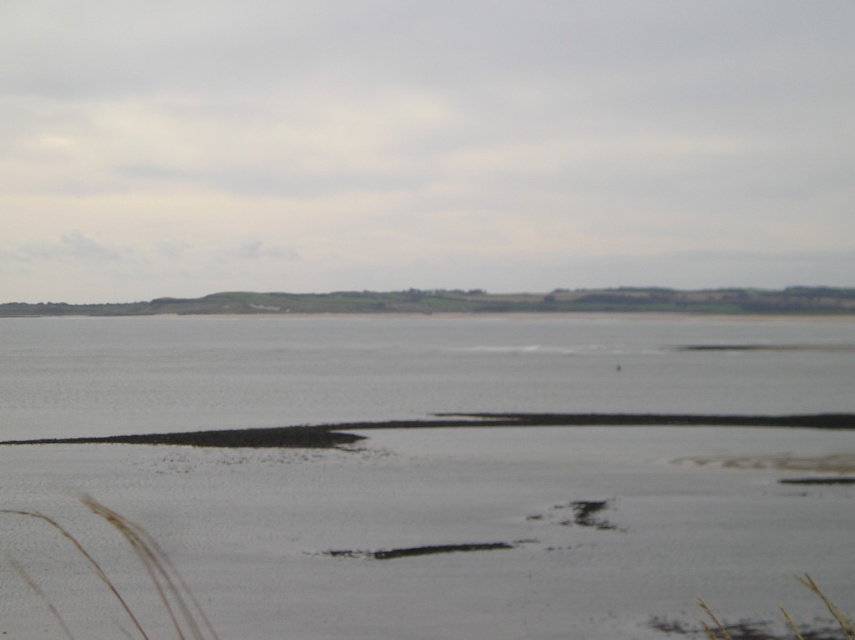
You are standing at the edge of the lake and see two points marked on the water surface. The first point is at coordinates point [51,497] and the second is at point [390,396]. Which point is closer to your current position?

Point [51,497] is closer to the viewer than point [390,396], so the first point is closer to your current position.

You are standing at the edge of the white sandy beach at lower center and want to walk to the gray matte water at center. Based on the scene description, which area is narrower in width between the two?

The white sandy beach at lower center has a lesser width compared to the gray matte water at center, so the white sandy beach at lower center is narrower in width.